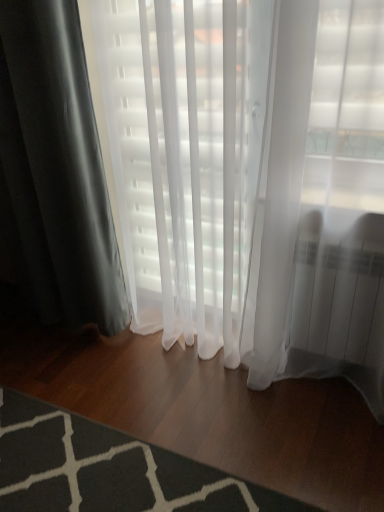
This screenshot has width=384, height=512. Find the location of `spots to the right of dark gray textured rug at lower left`. spots to the right of dark gray textured rug at lower left is located at coordinates (272, 431).